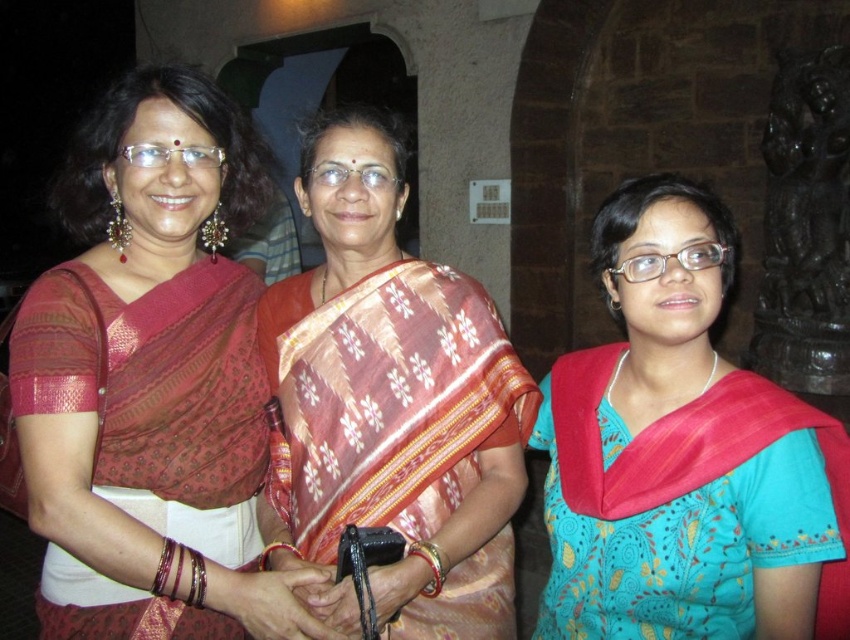
Question: Which object is the farthest from the teal silk blouse at center?

Choices:
 (A) silk saree at center
 (B) matte silk saree at center

Answer: (B)

Question: Observing the image, what is the correct spatial positioning of matte silk saree at center in reference to teal silk blouse at center?

Choices:
 (A) above
 (B) below

Answer: (A)

Question: Which of the following is the closest to the observer?

Choices:
 (A) matte silk saree at center
 (B) teal silk blouse at center

Answer: (B)

Question: Is the position of teal silk blouse at center less distant than that of silk saree at center?

Choices:
 (A) yes
 (B) no

Answer: (A)

Question: Which object is positioned farthest from the silk saree at center?

Choices:
 (A) matte silk saree at center
 (B) teal silk blouse at center

Answer: (B)

Question: Does matte silk saree at center have a greater width compared to silk saree at center?

Choices:
 (A) no
 (B) yes

Answer: (B)